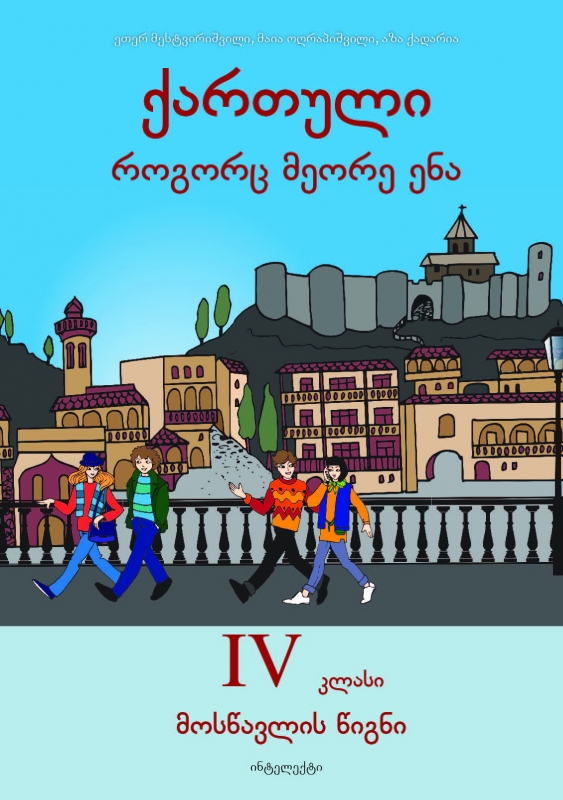
This screenshot has width=563, height=800. I want to click on doorway, so click(x=454, y=473).